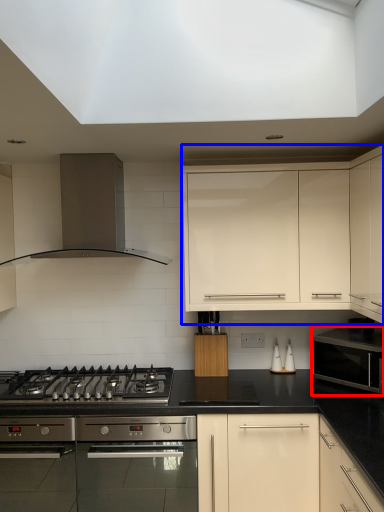
Question: Among these objects, which one is farthest to the camera, microwave oven (highlighted by a red box) or cabinetry (highlighted by a blue box)?

Choices:
 (A) microwave oven
 (B) cabinetry

Answer: (B)